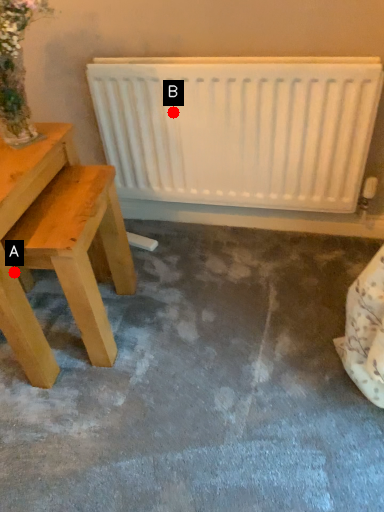
Question: Two points are circled on the image, labeled by A and B beside each circle. Which point appears closest to the camera in this image?

Choices:
 (A) A is closer
 (B) B is closer

Answer: (A)